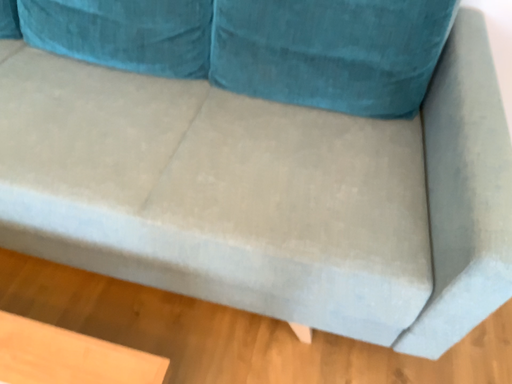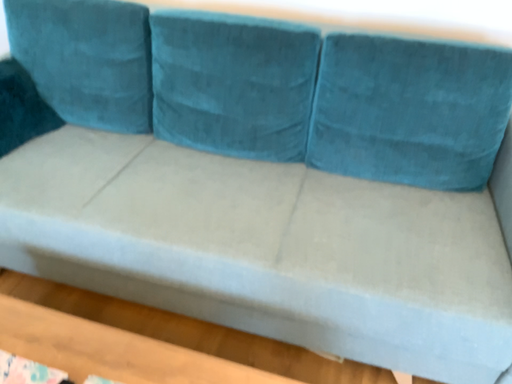
Question: Which way did the camera rotate in the video?

Choices:
 (A) rotated downward
 (B) rotated upward

Answer: (B)